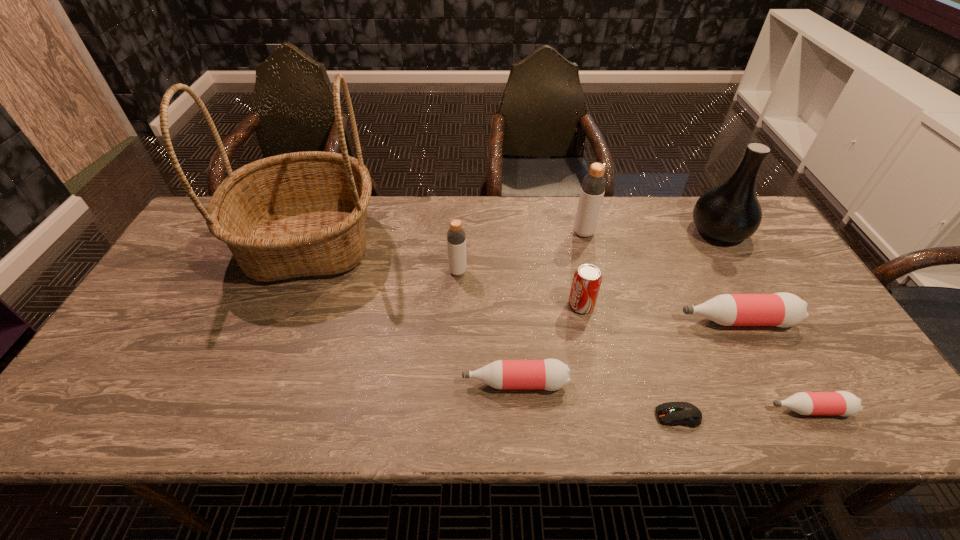
Locate which pink bottle is the closest to the second nearest bottle. Please provide its 2D coordinates. Your answer should be formatted as a tuple, i.e. [(x, y)], where the tuple contains the x and y coordinates of a point satisfying the conditions above.

[(782, 309)]

Identify the location of pink bottle that is the third closest to the soda can. The image size is (960, 540). (843, 403).